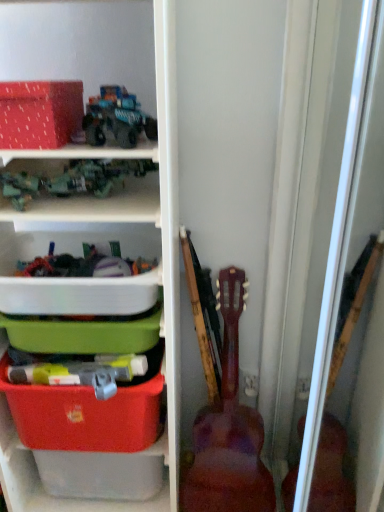
Question: Does matte plastic storage bin at left have a greater height compared to wooden acoustic guitar at right?

Choices:
 (A) no
 (B) yes

Answer: (B)

Question: From a real-world perspective, is matte plastic storage bin at left under wooden acoustic guitar at right?

Choices:
 (A) yes
 (B) no

Answer: (B)

Question: Does matte plastic storage bin at left contain wooden acoustic guitar at right?

Choices:
 (A) no
 (B) yes

Answer: (A)

Question: Is matte plastic storage bin at left completely or partially outside of wooden acoustic guitar at right?

Choices:
 (A) yes
 (B) no

Answer: (A)

Question: Is matte plastic storage bin at left thinner than wooden acoustic guitar at right?

Choices:
 (A) no
 (B) yes

Answer: (A)

Question: Is the depth of matte plastic storage bin at left greater than that of wooden acoustic guitar at right?

Choices:
 (A) no
 (B) yes

Answer: (A)

Question: Is matte red storage box at upper left, the first storage box in the top-to-bottom sequence, not close to wooden acoustic guitar at right?

Choices:
 (A) no
 (B) yes

Answer: (A)

Question: Does matte red storage box at upper left, the first storage box in the top-to-bottom sequence, have a smaller size compared to wooden acoustic guitar at right?

Choices:
 (A) no
 (B) yes

Answer: (B)

Question: From a real-world perspective, is matte red storage box at upper left, the first storage box in the top-to-bottom sequence, beneath wooden acoustic guitar at right?

Choices:
 (A) no
 (B) yes

Answer: (A)

Question: Could you tell me if matte red storage box at upper left, the 3th storage box positioned from the bottom, is facing wooden acoustic guitar at right?

Choices:
 (A) no
 (B) yes

Answer: (A)

Question: Is matte red storage box at upper left, the 3th storage box positioned from the bottom, at the right side of wooden acoustic guitar at right?

Choices:
 (A) no
 (B) yes

Answer: (A)

Question: Is matte red storage box at upper left, the 3th storage box positioned from the bottom, thinner than wooden acoustic guitar at right?

Choices:
 (A) no
 (B) yes

Answer: (B)

Question: Considering the relative sizes of white plastic container at center, which is the second storage box in bottom-to-top order, and teal matte truck at upper center, which is the first toy from top to bottom, in the image provided, is white plastic container at center, which is the second storage box in bottom-to-top order, smaller than teal matte truck at upper center, which is the first toy from top to bottom,?

Choices:
 (A) no
 (B) yes

Answer: (A)